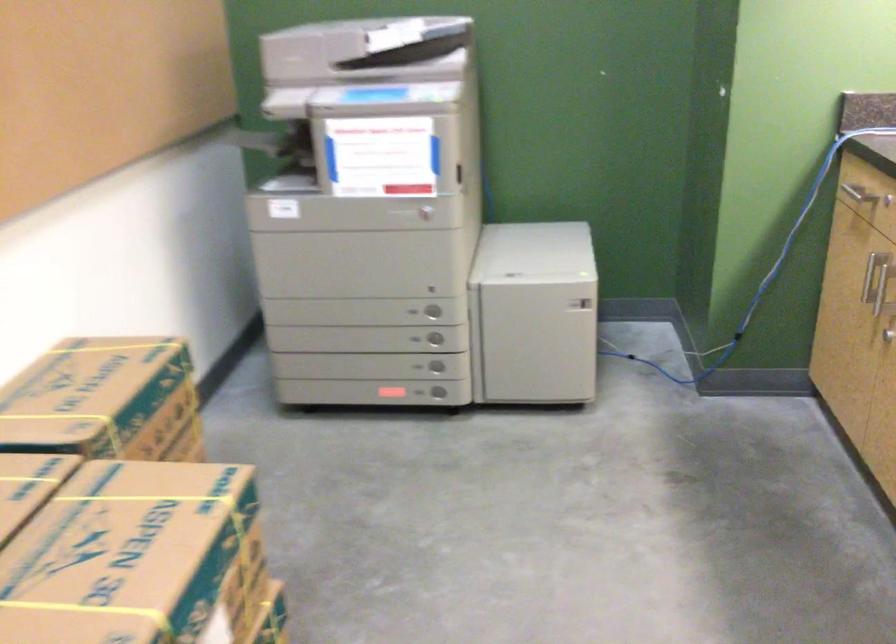
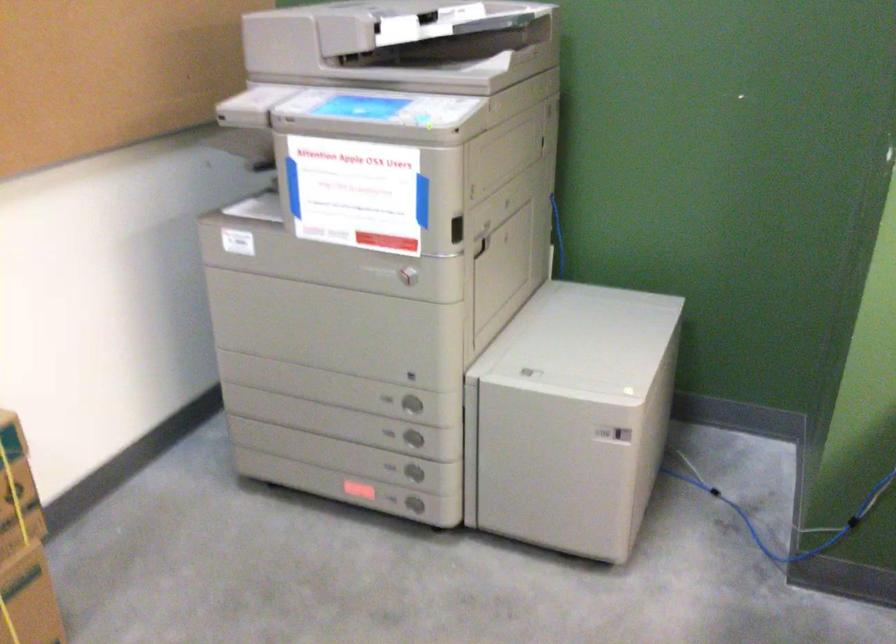
In the second image, find the point that corresponds to point (436, 366) in the first image.

(412, 471)